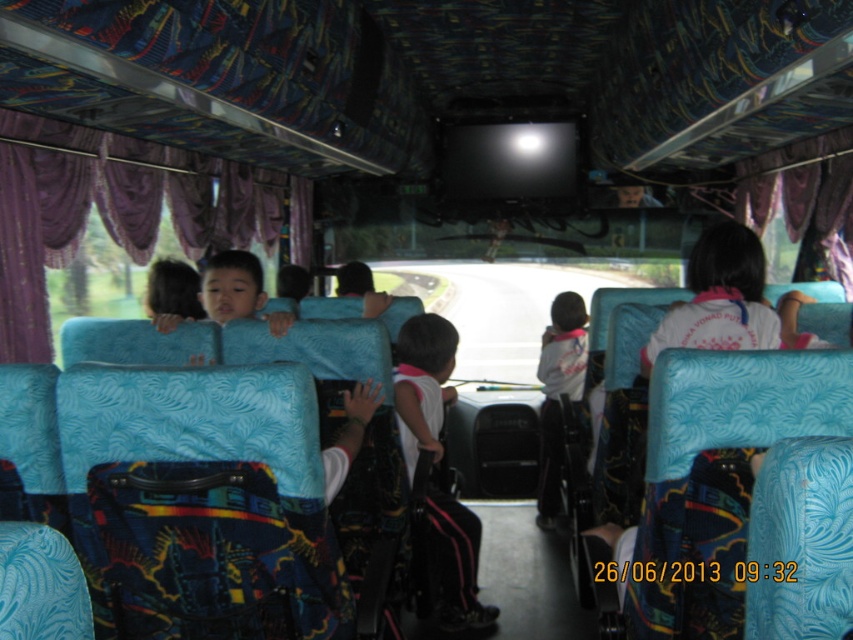
Where is `purple velvet curtain at left`? purple velvet curtain at left is located at coordinates (119, 212).

Which is more to the right, purple velvet curtain at left or white matte shirt at center?

Positioned to the right is white matte shirt at center.

Which is behind, point (225, 221) or point (421, 413)?

Point (225, 221)

Where is `purple velvet curtain at left`? purple velvet curtain at left is located at coordinates (119, 212).

Is white matte shirt at center positioned at the back of white cotton shirt at center?

No, white matte shirt at center is closer to the viewer.

Who is more forward, (469, 584) or (543, 528)?

Point (469, 584) is more forward.

The image size is (853, 640). What are the coordinates of `white matte shirt at center` in the screenshot? It's located at (422, 385).

Who is taller, purple velvet curtain at left or white cotton shirt at center?

With more height is white cotton shirt at center.

Does purple velvet curtain at left have a lesser width compared to white cotton shirt at center?

No.

Based on the photo, measure the distance between purple velvet curtain at left and camera.

They are 8.48 feet apart.

You are a GUI agent. You are given a task and a screenshot of the screen. Output one action in this format:
    pyautogui.click(x=<x>, y=<y>)
    Task: Click on the purple velvet curtain at left
    The width and height of the screenshot is (853, 640).
    Given the screenshot: What is the action you would take?
    pyautogui.click(x=119, y=212)